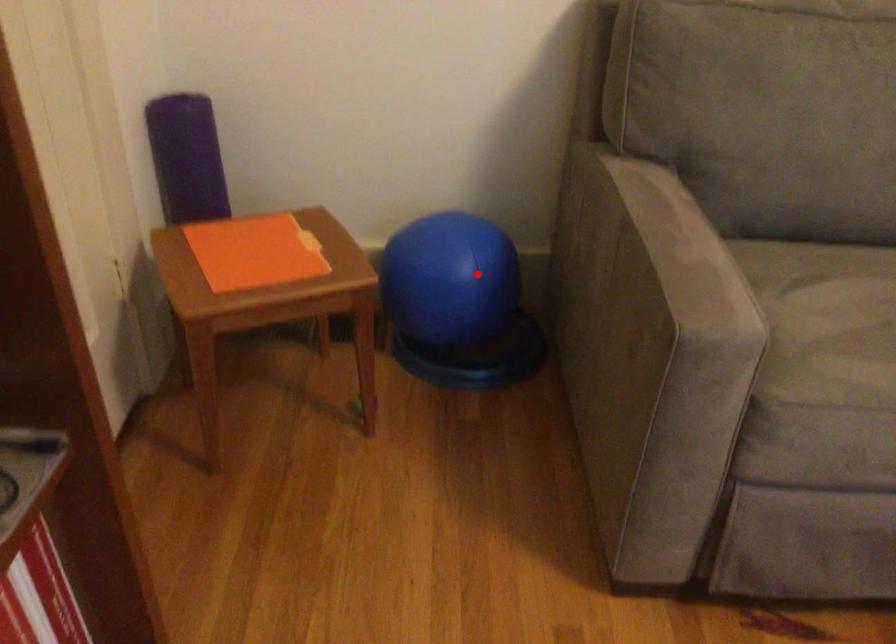
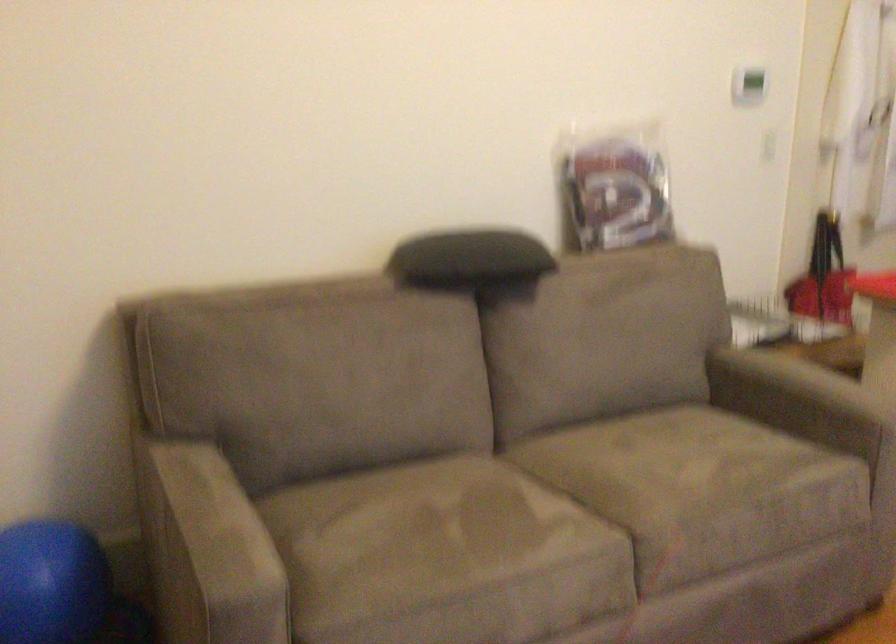
The point at the highlighted location is marked in the first image. Where is the corresponding point in the second image?

(49, 583)